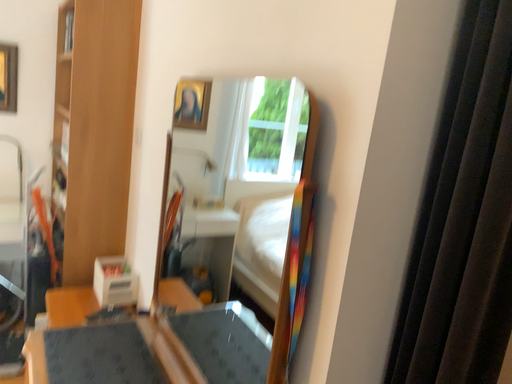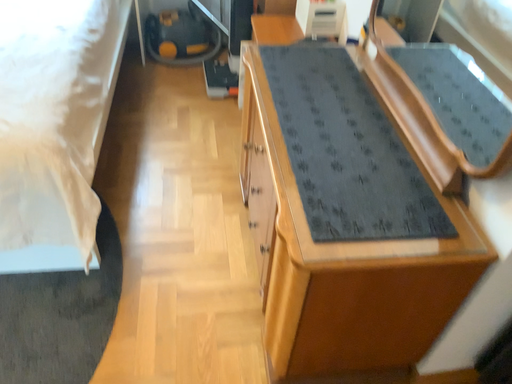
Question: Which way did the camera rotate in the video?

Choices:
 (A) rotated downward
 (B) rotated upward

Answer: (A)